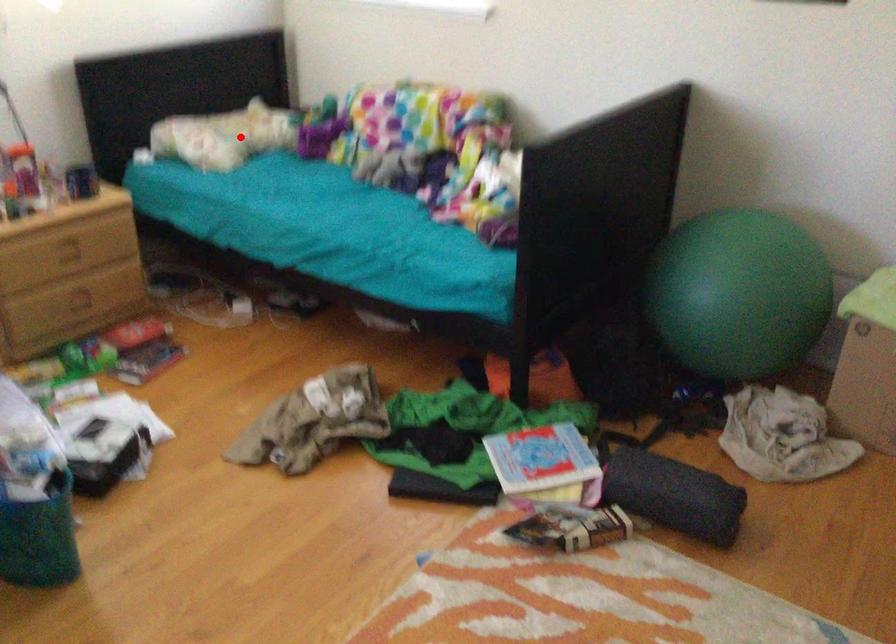
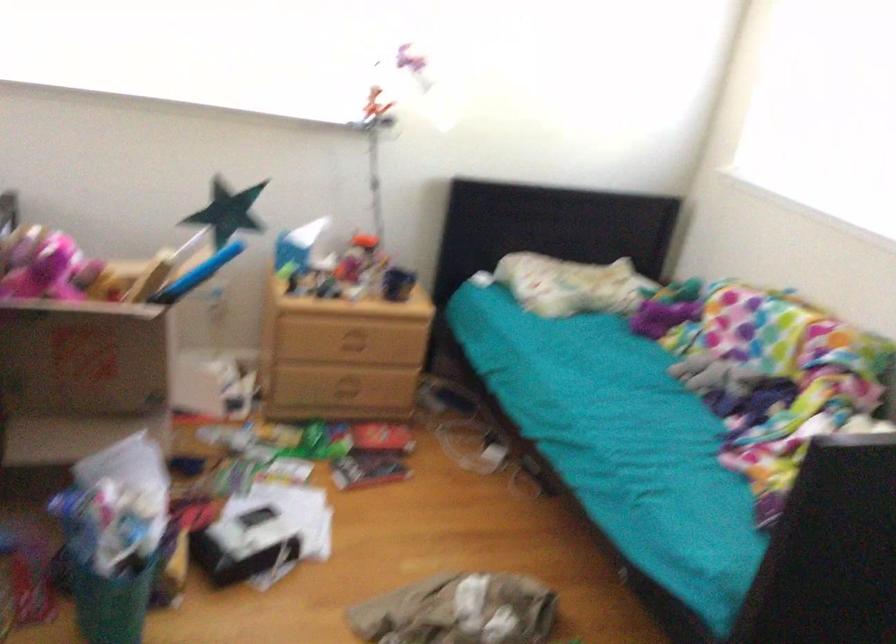
Find the pixel in the second image that matches the highlighted location in the first image.

(572, 285)